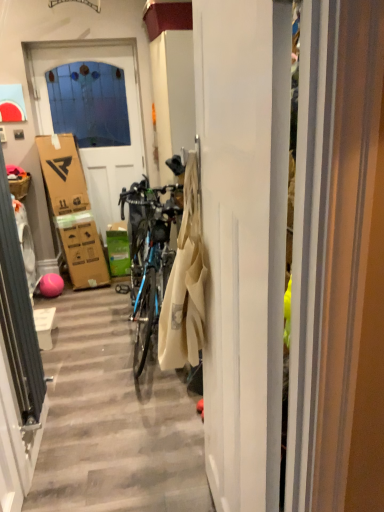
The width and height of the screenshot is (384, 512). Describe the element at coordinates (118, 249) in the screenshot. I see `green cardboard box at center` at that location.

Identify the location of white matte door at center, which ranks as the 1th door in front-to-back order. (243, 240).

Identify the location of brown cardboard picnic basket at left. The height and width of the screenshot is (512, 384). (20, 186).

From a real-world perspective, which object stands above the other?

white matte door at center, which ranks as the 1th door in front-to-back order, from a real-world perspective.

Is green cardboard box at center with white matte door at center, which ranks as the 1th door in front-to-back order?

green cardboard box at center and white matte door at center, which ranks as the 1th door in front-to-back order, are not in contact.

From the image's perspective, which is above, green cardboard box at center or white matte door at center, which ranks as the 1th door in front-to-back order?

green cardboard box at center.

Are white matte door at center, which ranks as the 1th door in front-to-back order, and white glossy washing machine at left beside each other?

No, white matte door at center, which ranks as the 1th door in front-to-back order, is not beside white glossy washing machine at left.

In the scene shown: Is white matte door at center, which ranks as the 1th door in front-to-back order, to the left of white glossy washing machine at left from the viewer's perspective?

No.

From their relative heights in the image, would you say white matte door at center, which ranks as the 1th door in front-to-back order, is taller or shorter than white glossy washing machine at left?

Clearly, white matte door at center, which ranks as the 1th door in front-to-back order, is taller compared to white glossy washing machine at left.

Is brown cardboard picnic basket at left aimed at beige cotton laundry at center?

No.

Is brown cardboard picnic basket at left not inside beige cotton laundry at center?

Yes, brown cardboard picnic basket at left is located beyond the bounds of beige cotton laundry at center.

From the image's perspective, is brown cardboard picnic basket at left above or below beige cotton laundry at center?

brown cardboard picnic basket at left is above beige cotton laundry at center.

How many degrees apart are the facing directions of brown cardboard picnic basket at left and beige cotton laundry at center?

The angular difference between brown cardboard picnic basket at left and beige cotton laundry at center is 178 degrees.

Considering the relative positions of white matte door at upper left, which ranks as the 2th door in front-to-back order, and white matte door at center, marked as the 1th door in a right-to-left arrangement, in the image provided, is white matte door at upper left, which ranks as the 2th door in front-to-back order, in front of white matte door at center, marked as the 1th door in a right-to-left arrangement,?

No, the depth of white matte door at upper left, which ranks as the 2th door in front-to-back order, is greater than that of white matte door at center, marked as the 1th door in a right-to-left arrangement.

From the image's perspective, does white matte door at upper left, the 1th door in the back-to-front sequence, appear higher than white matte door at center, which is the 2th door from left to right?

Correct, white matte door at upper left, the 1th door in the back-to-front sequence, appears higher than white matte door at center, which is the 2th door from left to right, in the image.

Are white matte door at upper left, which ranks as the 2th door in front-to-back order, and white matte door at center, which ranks as the 1th door in front-to-back order, beside each other?

white matte door at upper left, which ranks as the 2th door in front-to-back order, and white matte door at center, which ranks as the 1th door in front-to-back order, are clearly separated.

This screenshot has height=512, width=384. Find the location of `washing machine above the green cardboard box at center (from a real-world perspective)`. washing machine above the green cardboard box at center (from a real-world perspective) is located at coordinates point(25,244).

Between white glossy washing machine at left and green cardboard box at center, which one is positioned behind?

green cardboard box at center is behind.

Does white glossy washing machine at left have a lesser height compared to green cardboard box at center?

Incorrect, the height of white glossy washing machine at left does not fall short of that of green cardboard box at center.

How much distance is there between white glossy washing machine at left and green cardboard box at center?

31.95 inches.

Which of these two, white glossy washing machine at left or beige cotton laundry at center, is bigger?

white glossy washing machine at left is bigger.

Does point (22, 242) lie in front of point (169, 341)?

No, (22, 242) is behind (169, 341).

Which object is wider, white glossy washing machine at left or beige cotton laundry at center?

Wider between the two is white glossy washing machine at left.

Can you see white matte door at upper left, which ranks as the 2th door in front-to-back order, touching beige cotton laundry at center?

No, white matte door at upper left, which ranks as the 2th door in front-to-back order, is not beside beige cotton laundry at center.

Is white matte door at upper left, which ranks as the 2th door in front-to-back order, positioned behind beige cotton laundry at center?

Yes, the depth of white matte door at upper left, which ranks as the 2th door in front-to-back order, is greater than that of beige cotton laundry at center.

Consider the image. From a real-world perspective, is white matte door at upper left, which is counted as the 2th door, starting from the right, located higher than beige cotton laundry at center?

Indeed, from a real-world perspective, white matte door at upper left, which is counted as the 2th door, starting from the right, stands above beige cotton laundry at center.

Who is smaller, white matte door at upper left, the 1th door in the back-to-front sequence, or beige cotton laundry at center?

With smaller size is beige cotton laundry at center.

Locate an element on the screen. the 1st door above the green cardboard box at center (from a real-world perspective) is located at coordinates (243, 240).

Find the location of a particular element. This screenshot has height=512, width=384. washing machine above the white matte door at center, which ranks as the 1th door in front-to-back order (from the image's perspective) is located at coordinates [25, 244].

From the image, which object appears to be farther from white matte door at upper left, the 1th door in the back-to-front sequence, brown cardboard picnic basket at left or green cardboard box at center?

Among the two, brown cardboard picnic basket at left is located further to white matte door at upper left, the 1th door in the back-to-front sequence.

Estimate the real-world distances between objects in this image. Which object is closer to white matte door at upper left, which ranks as the 2th door in front-to-back order, white matte door at center, which ranks as the 1th door in front-to-back order, or green cardboard box at center?

green cardboard box at center is positioned closer to the anchor white matte door at upper left, which ranks as the 2th door in front-to-back order.

Consider the image. Considering their positions, is white glossy washing machine at left positioned further to white matte door at upper left, which is counted as the 2th door, starting from the right, than brown cardboard picnic basket at left?

white glossy washing machine at left lies further to white matte door at upper left, which is counted as the 2th door, starting from the right, than the other object.

Estimate the real-world distances between objects in this image. Which object is further from green cardboard box at center, white matte door at upper left, which ranks as the 2th door in front-to-back order, or brown cardboard picnic basket at left?

brown cardboard picnic basket at left.

Considering their positions, is green cardboard box at center positioned closer to white glossy washing machine at left than brown cardboard picnic basket at left?

Based on the image, brown cardboard picnic basket at left appears to be nearer to white glossy washing machine at left.

Estimate the real-world distances between objects in this image. Which object is closer to white matte door at center, marked as the 1th door in a right-to-left arrangement, beige cotton laundry at center or green cardboard box at center?

beige cotton laundry at center is positioned closer to the anchor white matte door at center, marked as the 1th door in a right-to-left arrangement.

When comparing their distances from white matte door at upper left, the 1th door in the back-to-front sequence, does white glossy washing machine at left or beige cotton laundry at center seem further?

Based on the image, beige cotton laundry at center appears to be further to white matte door at upper left, the 1th door in the back-to-front sequence.

Estimate the real-world distances between objects in this image. Which object is closer to white matte door at center, acting as the second door starting from the back, brown cardboard picnic basket at left or beige cotton laundry at center?

Based on the image, beige cotton laundry at center appears to be nearer to white matte door at center, acting as the second door starting from the back.

The height and width of the screenshot is (512, 384). I want to click on washing machine positioned between beige cotton laundry at center and white matte door at upper left, which is counted as the 2th door, starting from the right, from near to far, so click(25, 244).

Identify the location of box between white matte door at upper left, the 1th door in the back-to-front sequence, and white glossy washing machine at left from top to bottom. The height and width of the screenshot is (512, 384). (118, 249).

This screenshot has width=384, height=512. In order to click on door located between brown cardboard picnic basket at left and green cardboard box at center in the left-right direction in this screenshot , I will do `click(90, 146)`.

Where is `door located between beige cotton laundry at center and green cardboard box at center in the depth direction`? The height and width of the screenshot is (512, 384). door located between beige cotton laundry at center and green cardboard box at center in the depth direction is located at coordinates (90, 146).